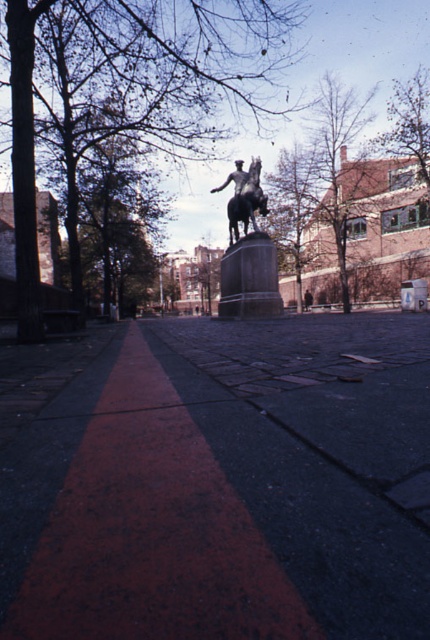
You are standing in the public square looking at the statue. There are two points marked on the ground in front of the statue. One is at coordinates point [278,301] and the other at point [258,163]. Which of these two points is closer to you?

Point [278,301] is closer to the camera than point [258,163].